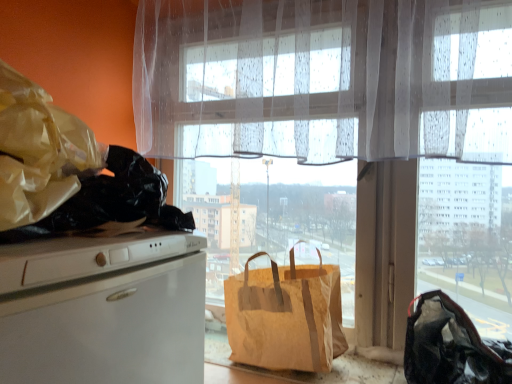
The width and height of the screenshot is (512, 384). Find the location of `translucent white curtain at upper center`. translucent white curtain at upper center is located at coordinates (324, 79).

Between black fabric bag at lower right, acting as the 1th handbag starting from the right, and brown paper bag at window, the second handbag viewed from the right, which one has less height?

black fabric bag at lower right, acting as the 1th handbag starting from the right.

Is brown paper bag at window, the first handbag when ordered from left to right, completely or partially inside black fabric bag at lower right, acting as the 1th handbag starting from the right?

No, brown paper bag at window, the first handbag when ordered from left to right, is not a part of black fabric bag at lower right, acting as the 1th handbag starting from the right.

Are black fabric bag at lower right, acting as the 2th handbag starting from the left, and brown paper bag at window, the second handbag viewed from the right, making contact?

black fabric bag at lower right, acting as the 2th handbag starting from the left, is not next to brown paper bag at window, the second handbag viewed from the right, and they're not touching.

Is black fabric bag at lower right, acting as the 2th handbag starting from the left, positioned behind translucent fabric window at center?

No, black fabric bag at lower right, acting as the 2th handbag starting from the left, is closer to the viewer.

Is translucent fabric window at center located within black fabric bag at lower right, acting as the 2th handbag starting from the left?

No, translucent fabric window at center is not a part of black fabric bag at lower right, acting as the 2th handbag starting from the left.

Is translucent fabric window at center at the back of black fabric bag at lower right, acting as the 2th handbag starting from the left?

Yes.

Is point (245, 30) positioned before point (253, 306)?

No, it is behind (253, 306).

How distant is translucent fabric window at center from brown paper bag at window, the first handbag when ordered from left to right?

translucent fabric window at center and brown paper bag at window, the first handbag when ordered from left to right, are 10.07 inches apart.

From a real-world perspective, is translucent fabric window at center on top of brown paper bag at window, the first handbag when ordered from left to right?

Correct, in the physical world, translucent fabric window at center is higher than brown paper bag at window, the first handbag when ordered from left to right.

Considering the relative positions of translucent fabric window at center and brown paper bag at window, the first handbag when ordered from left to right, in the image provided, is translucent fabric window at center to the right of brown paper bag at window, the first handbag when ordered from left to right, from the viewer's perspective?

Yes.

Can you see brown paper bag at window, the second handbag viewed from the right, touching translucent fabric window at center?

No.

Is brown paper bag at window, the first handbag when ordered from left to right, located outside translucent fabric window at center?

brown paper bag at window, the first handbag when ordered from left to right, lies outside translucent fabric window at center's area.

How different are the orientations of brown paper bag at window, the first handbag when ordered from left to right, and translucent fabric window at center in degrees?

brown paper bag at window, the first handbag when ordered from left to right, and translucent fabric window at center are facing 2.08 degrees away from each other.

From the image's perspective, is brown paper bag at window, the second handbag viewed from the right, on top of translucent fabric window at center?

No, from the image's perspective, brown paper bag at window, the second handbag viewed from the right, is not on top of translucent fabric window at center.

Is translucent fabric window at center placed right next to black fabric bag at lower right, acting as the 1th handbag starting from the right?

No, translucent fabric window at center is not touching black fabric bag at lower right, acting as the 1th handbag starting from the right.

Is translucent fabric window at center turned away from black fabric bag at lower right, acting as the 1th handbag starting from the right?

Yes, translucent fabric window at center's orientation is away from black fabric bag at lower right, acting as the 1th handbag starting from the right.

From a real-world perspective, is translucent fabric window at center beneath black fabric bag at lower right, acting as the 2th handbag starting from the left?

No, from a real-world perspective, translucent fabric window at center is not under black fabric bag at lower right, acting as the 2th handbag starting from the left.

How much distance is there between translucent fabric window at center and black fabric bag at lower right, acting as the 1th handbag starting from the right?

translucent fabric window at center and black fabric bag at lower right, acting as the 1th handbag starting from the right, are 41.62 centimeters apart.

From a real-world perspective, is translucent fabric window at center on top of translucent white curtain at upper center?

No, from a real-world perspective, translucent fabric window at center is not over translucent white curtain at upper center

In terms of width, does translucent fabric window at center look wider or thinner when compared to translucent white curtain at upper center?

Clearly, translucent fabric window at center has less width compared to translucent white curtain at upper center.

Find the location of `window lying below the translucent white curtain at upper center (from the image's perspective)`. window lying below the translucent white curtain at upper center (from the image's perspective) is located at coordinates (324, 128).

In terms of height, does translucent fabric window at center look taller or shorter compared to translucent white curtain at upper center?

Considering their sizes, translucent fabric window at center has more height than translucent white curtain at upper center.

From the image's perspective, is black fabric bag at lower right, acting as the 2th handbag starting from the left, located beneath translucent white curtain at upper center?

Yes, from the image's perspective, black fabric bag at lower right, acting as the 2th handbag starting from the left, is below translucent white curtain at upper center.

Is point (474, 383) closer or farther from the camera than point (486, 146)?

Point (474, 383) is farther from the camera than point (486, 146).

Is black fabric bag at lower right, acting as the 1th handbag starting from the right, oriented towards translucent white curtain at upper center?

No, black fabric bag at lower right, acting as the 1th handbag starting from the right, does not turn towards translucent white curtain at upper center.

Which object is closer to the camera, black fabric bag at lower right, acting as the 2th handbag starting from the left, or translucent white curtain at upper center?

Positioned in front is black fabric bag at lower right, acting as the 2th handbag starting from the left.

Locate an element on the screen. This screenshot has height=384, width=512. handbag on the left of black fabric bag at lower right, acting as the 1th handbag starting from the right is located at coordinates (285, 316).

Where is `window lying behind the black fabric bag at lower right, acting as the 1th handbag starting from the right`? window lying behind the black fabric bag at lower right, acting as the 1th handbag starting from the right is located at coordinates (324, 128).

When comparing their distances from translucent fabric window at center, does black fabric bag at lower right, acting as the 1th handbag starting from the right, or translucent white curtain at upper center seem closer?

Based on the image, translucent white curtain at upper center appears to be nearer to translucent fabric window at center.

Based on their spatial positions, is brown paper bag at window, the second handbag viewed from the right, or translucent white curtain at upper center closer to black fabric bag at lower right, acting as the 1th handbag starting from the right?

brown paper bag at window, the second handbag viewed from the right.

Looking at this image, when comparing their distances from black fabric bag at lower right, acting as the 1th handbag starting from the right, does brown paper bag at window, the first handbag when ordered from left to right, or translucent fabric window at center seem further?

translucent fabric window at center is positioned further to the anchor black fabric bag at lower right, acting as the 1th handbag starting from the right.

Considering their positions, is translucent white curtain at upper center positioned further to brown paper bag at window, the first handbag when ordered from left to right, than translucent fabric window at center?

The object further to brown paper bag at window, the first handbag when ordered from left to right, is translucent white curtain at upper center.

Which object lies further to the anchor point brown paper bag at window, the second handbag viewed from the right, black fabric bag at lower right, acting as the 2th handbag starting from the left, or translucent fabric window at center?

black fabric bag at lower right, acting as the 2th handbag starting from the left, is positioned further to the anchor brown paper bag at window, the second handbag viewed from the right.

Looking at this image, from the image, which object appears to be nearer to brown paper bag at window, the first handbag when ordered from left to right, translucent white curtain at upper center or black fabric bag at lower right, acting as the 2th handbag starting from the left?

Based on the image, black fabric bag at lower right, acting as the 2th handbag starting from the left, appears to be nearer to brown paper bag at window, the first handbag when ordered from left to right.

Estimate the real-world distances between objects in this image. Which object is further from brown paper bag at window, the first handbag when ordered from left to right, black fabric bag at lower right, acting as the 1th handbag starting from the right, or translucent white curtain at upper center?

translucent white curtain at upper center.

Estimate the real-world distances between objects in this image. Which object is closer to brown paper bag at window, the second handbag viewed from the right, translucent fabric window at center or black fabric bag at lower right, acting as the 1th handbag starting from the right?

translucent fabric window at center is positioned closer to the anchor brown paper bag at window, the second handbag viewed from the right.

Identify the location of window between translucent white curtain at upper center and brown paper bag at window, the first handbag when ordered from left to right, vertically. The image size is (512, 384). (324, 128).

The width and height of the screenshot is (512, 384). What are the coordinates of `handbag between translucent fabric window at center and black fabric bag at lower right, acting as the 1th handbag starting from the right, vertically` in the screenshot? It's located at (285, 316).

This screenshot has height=384, width=512. I want to click on window that lies between translucent white curtain at upper center and black fabric bag at lower right, acting as the 1th handbag starting from the right, from top to bottom, so click(324, 128).

At what (x,y) coordinates should I click in order to perform the action: click on handbag between translucent white curtain at upper center and black fabric bag at lower right, acting as the 1th handbag starting from the right, from top to bottom. Please return your answer as a coordinate pair (x, y). Looking at the image, I should click on (285, 316).